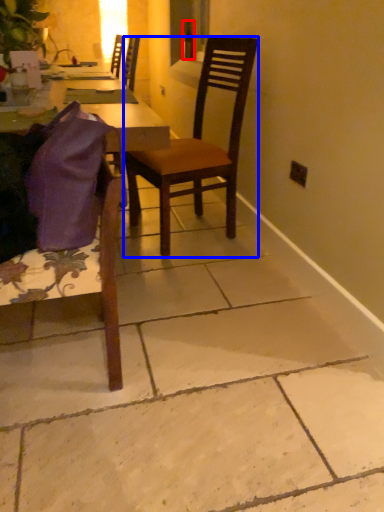
Question: Which of the following is the closest to the observer, bottle (highlighted by a red box) or chair (highlighted by a blue box)?

Choices:
 (A) bottle
 (B) chair

Answer: (B)